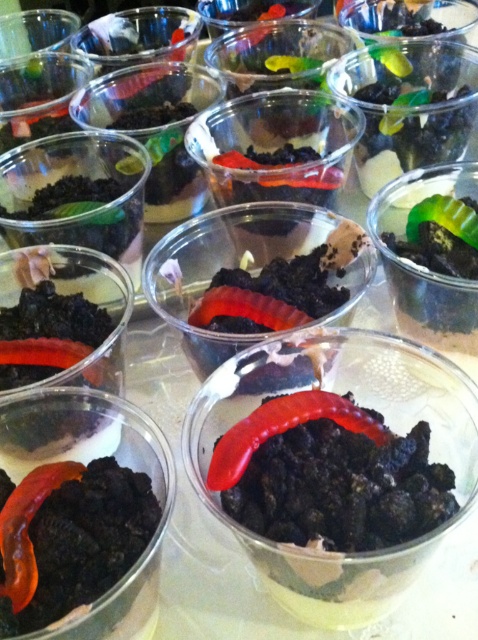
Question: Is rubbery red worm at center above rubbery red worm at lower left?

Choices:
 (A) no
 (B) yes

Answer: (B)

Question: Which object is positioned farthest from the matte plastic bowl at center?

Choices:
 (A) orange rubber worm at center
 (B) rubbery red worm at center
 (C) green matte gummy worm at center
 (D) matte plastic cup at center

Answer: (A)

Question: Does matte plastic cup at center appear under rubbery red worm at center?

Choices:
 (A) yes
 (B) no

Answer: (A)

Question: Which point appears farthest from the camera in this image?

Choices:
 (A) (271, 428)
 (B) (87, 512)
 (C) (436, 312)
 (D) (159, 301)

Answer: (D)

Question: Among these objects, which one is nearest to the camera?

Choices:
 (A) rubbery red worm at center
 (B) orange rubber worm at center
 (C) green matte gummy worm at center

Answer: (B)

Question: Can you confirm if matte plastic bowl at center is smaller than green matte gummy worm at center?

Choices:
 (A) yes
 (B) no

Answer: (B)